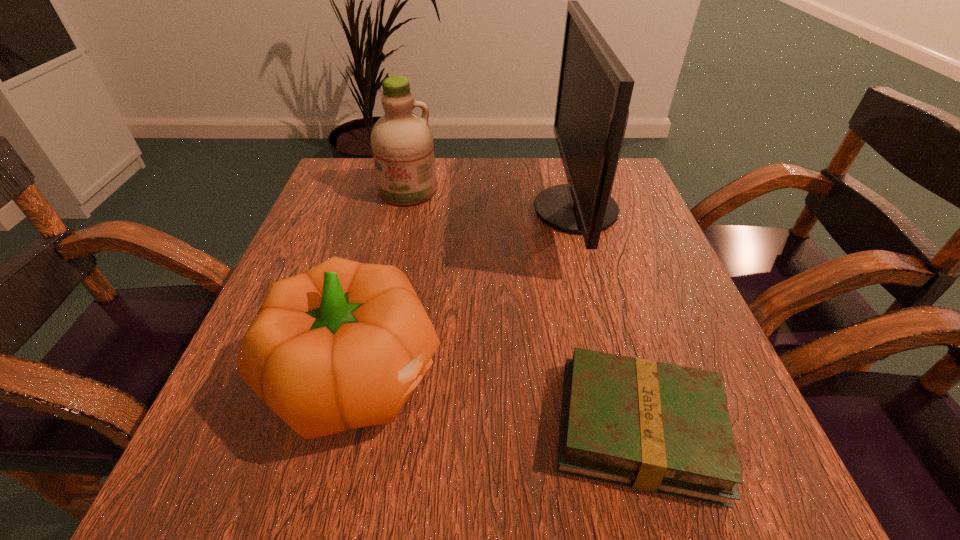
Locate an element on the screen. Image resolution: width=960 pixels, height=540 pixels. free space that satisfies the following two spatial constraints: 1. on the screen side of the tallest object; 2. on the left side of the shortest object is located at coordinates (636, 428).

You are a GUI agent. You are given a task and a screenshot of the screen. Output one action in this format:
    pyautogui.click(x=<x>, y=<y>)
    Task: Click on the free space that satisfies the following two spatial constraints: 1. on the front label of the book; 2. on the right side of the cleansing agent
    The height and width of the screenshot is (540, 960).
    Given the screenshot: What is the action you would take?
    pyautogui.click(x=356, y=428)